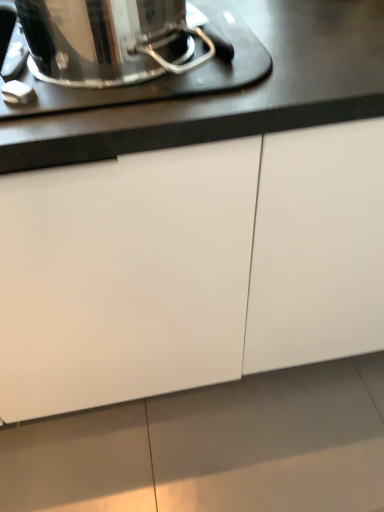
Describe the element at coordinates (189, 267) in the screenshot. I see `white matte cabinet at center` at that location.

This screenshot has width=384, height=512. What are the coordinates of `white matte cabinet at center` in the screenshot? It's located at (189, 267).

Image resolution: width=384 pixels, height=512 pixels. I want to click on polished stainless steel pot at upper left, so [163, 76].

Find the location of a particular element. white matte cabinet at center is located at coordinates (189, 267).

Is white glossy tile at lower center wider or thinner than polished stainless steel pot at upper left?

In the image, white glossy tile at lower center appears to be wider than polished stainless steel pot at upper left.

Is white glossy tile at lower center not within polished stainless steel pot at upper left?

Absolutely, white glossy tile at lower center is external to polished stainless steel pot at upper left.

Considering the positions of objects white glossy tile at lower center and polished stainless steel pot at upper left in the image provided, who is more to the left, white glossy tile at lower center or polished stainless steel pot at upper left?

Positioned to the left is polished stainless steel pot at upper left.

From a real-world perspective, is white matte cabinet at center on top of white glossy tile at lower center?

Yes, from a real-world perspective, white matte cabinet at center is over white glossy tile at lower center

Locate an element on the screen. tile below the white matte cabinet at center (from the image's perspective) is located at coordinates (274, 441).

Would you say white matte cabinet at center is outside white glossy tile at lower center?

Yes, white matte cabinet at center is located beyond the bounds of white glossy tile at lower center.

Consider the image. Can you confirm if white matte cabinet at center is thinner than white glossy tile at lower center?

Yes.

Based on the photo, how many degrees apart are the facing directions of polished stainless steel pot at upper left and white matte cabinet at center?

The angle between the facing direction of polished stainless steel pot at upper left and the facing direction of white matte cabinet at center is 2.88 degrees.

Between polished stainless steel pot at upper left and white matte cabinet at center, which one has more height?

white matte cabinet at center.

Are polished stainless steel pot at upper left and white matte cabinet at center located far from each other?

polished stainless steel pot at upper left is actually quite close to white matte cabinet at center.

Which is nearer, (13,17) or (150,267)?

Point (13,17) is positioned farther from the camera compared to point (150,267).

Is the depth of white matte cabinet at center greater than that of polished stainless steel pot at upper left?

No, white matte cabinet at center is closer to the viewer.

Which is correct: white matte cabinet at center is inside polished stainless steel pot at upper left, or outside of it?

white matte cabinet at center exists outside the volume of polished stainless steel pot at upper left.

Considering the points (33, 331) and (202, 79), which point is behind, point (33, 331) or point (202, 79)?

The point (33, 331) is farther from the camera.

Who is smaller, white matte cabinet at center or polished stainless steel pot at upper left?

With smaller size is polished stainless steel pot at upper left.

Is white matte cabinet at center completely or partially inside white glossy tile at lower center?

Actually, white matte cabinet at center is outside white glossy tile at lower center.

From a real-world perspective, who is located lower, white glossy tile at lower center or white matte cabinet at center?

white glossy tile at lower center is physically lower.

Considering the relative positions of white glossy tile at lower center and white matte cabinet at center in the image provided, is white glossy tile at lower center behind white matte cabinet at center?

Yes, it is behind white matte cabinet at center.

Does point (353, 423) come in front of point (241, 158)?

No, it is behind (241, 158).

How many degrees apart are the facing directions of polished stainless steel pot at upper left and white glossy tile at lower center?

The facing directions of polished stainless steel pot at upper left and white glossy tile at lower center are 93.7 degrees apart.

Can you confirm if polished stainless steel pot at upper left is positioned to the left of white glossy tile at lower center?

Indeed, polished stainless steel pot at upper left is positioned on the left side of white glossy tile at lower center.

In terms of size, does polished stainless steel pot at upper left appear bigger or smaller than white glossy tile at lower center?

Clearly, polished stainless steel pot at upper left is smaller in size than white glossy tile at lower center.

The width and height of the screenshot is (384, 512). I want to click on home appliance above the white glossy tile at lower center (from the image's perspective), so click(x=163, y=76).

Find the location of `cabinetry located above the white glossy tile at lower center (from a real-world perspective)`. cabinetry located above the white glossy tile at lower center (from a real-world perspective) is located at coordinates (189, 267).

From the image, which object appears to be nearer to white matte cabinet at center, polished stainless steel pot at upper left or white glossy tile at lower center?

Based on the image, polished stainless steel pot at upper left appears to be nearer to white matte cabinet at center.

From the picture: Based on their spatial positions, is white glossy tile at lower center or white matte cabinet at center further from polished stainless steel pot at upper left?

white glossy tile at lower center is further to polished stainless steel pot at upper left.

When comparing their distances from white glossy tile at lower center, does white matte cabinet at center or polished stainless steel pot at upper left seem further?

The object further to white glossy tile at lower center is polished stainless steel pot at upper left.

Based on their spatial positions, is white matte cabinet at center or white glossy tile at lower center further from polished stainless steel pot at upper left?

Among the two, white glossy tile at lower center is located further to polished stainless steel pot at upper left.

When comparing their distances from white glossy tile at lower center, does polished stainless steel pot at upper left or white matte cabinet at center seem closer?

white matte cabinet at center.

Based on their spatial positions, is white glossy tile at lower center or polished stainless steel pot at upper left further from white matte cabinet at center?

white glossy tile at lower center.

The width and height of the screenshot is (384, 512). I want to click on cabinetry between polished stainless steel pot at upper left and white glossy tile at lower center from top to bottom, so click(189, 267).